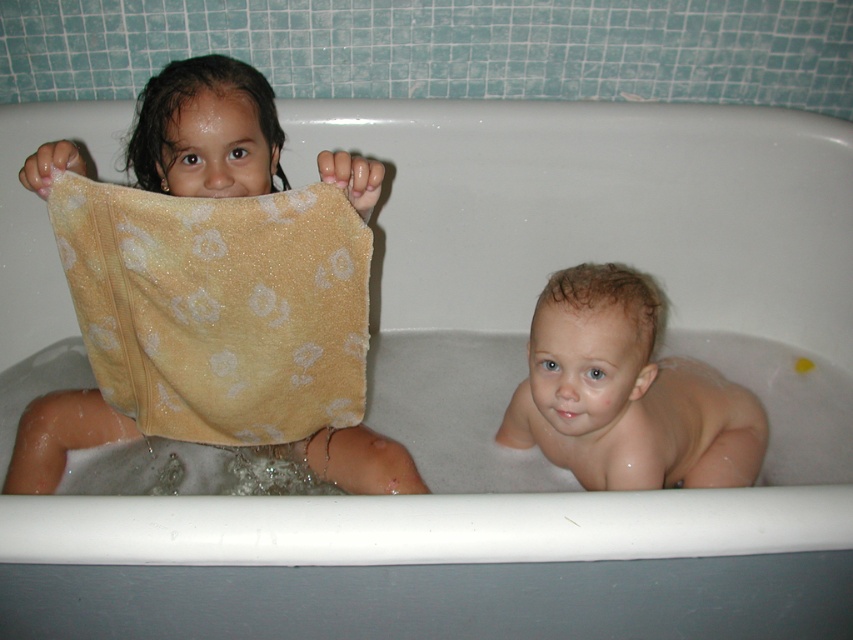
You are a parent checking the bathroom safety. You see the light brown wet hair at lower right and the yellow textured towel at left. Which object is positioned lower in the image?

The light brown wet hair at lower right is located below the yellow textured towel at left, so it is positioned lower in the image.

You are a parent trying to reach the yellow soft towel at upper left to dry your child. You are standing 40 inches away from the edge of the bathtub. Can you safely grab the towel without stepping into the bathtub?

The yellow soft towel at upper left is 39.27 inches away from the viewer. Since you are standing 40 inches away from the edge of the bathtub, you can safely reach the towel without stepping into the bathtub because the distance is just slightly more than the required reach.